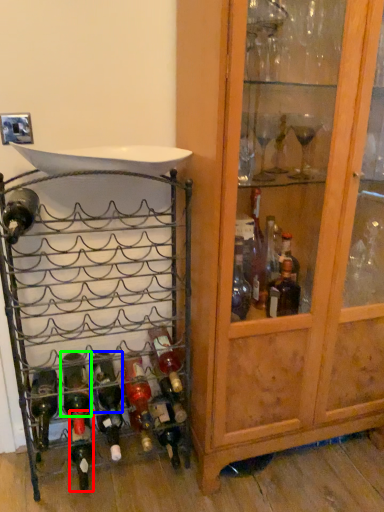
Question: Based on their relative distances, which object is farther from bottle (highlighted by a red box)? Choose from bottle (highlighted by a blue box) and bottle (highlighted by a green box).

Choices:
 (A) bottle
 (B) bottle

Answer: (A)